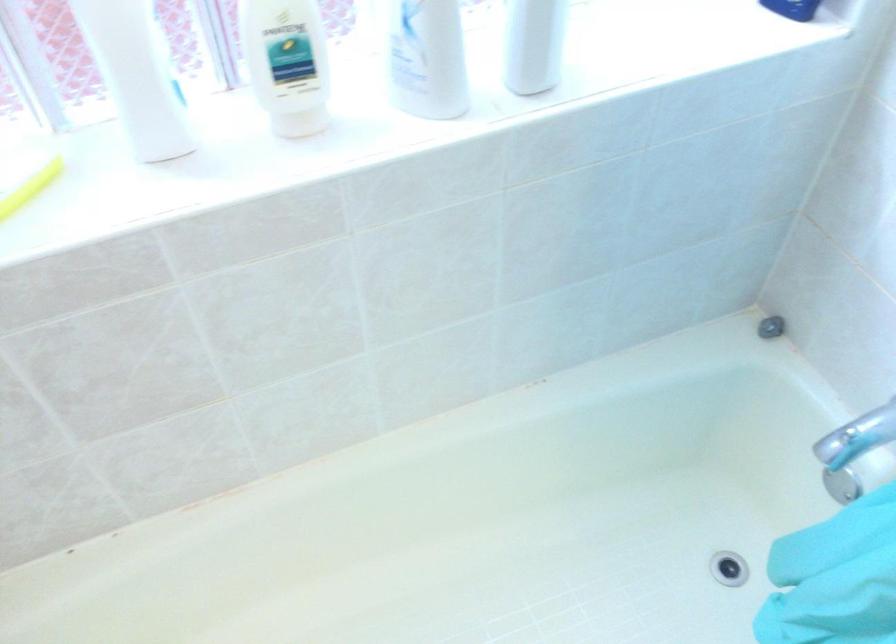
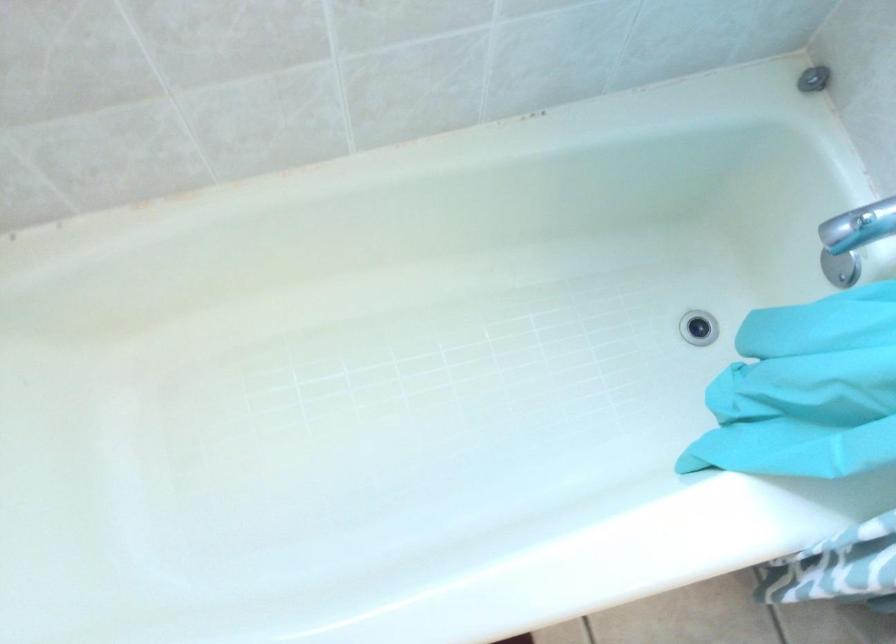
The point at (770,327) is marked in the first image. Where is the corresponding point in the second image?

(814, 79)